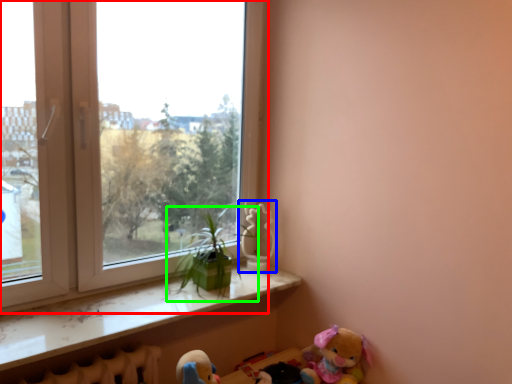
Question: Which object is the closest to the window (highlighted by a red box)? Choose among these: toy (highlighted by a blue box) or houseplant (highlighted by a green box).

Choices:
 (A) toy
 (B) houseplant

Answer: (B)